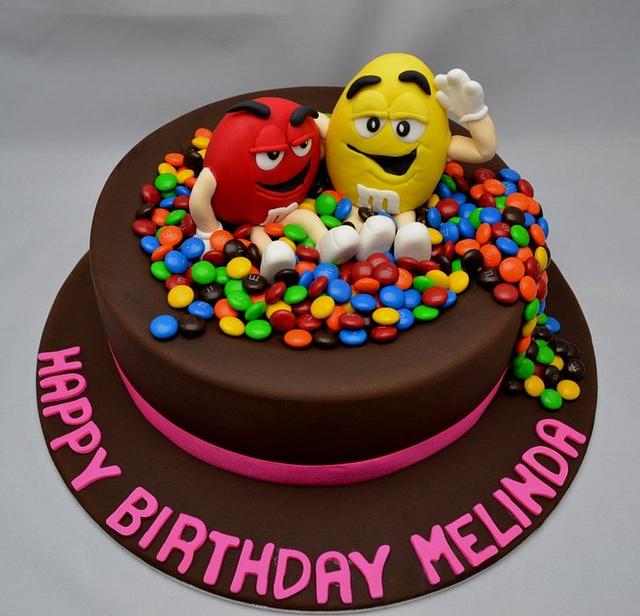
You are a GUI agent. You are given a task and a screenshot of the screen. Output one action in this format:
    pyautogui.click(x=<x>, y=<y>)
    Task: Click on the birthday cake
    
    Given the screenshot: What is the action you would take?
    pyautogui.click(x=378, y=386)